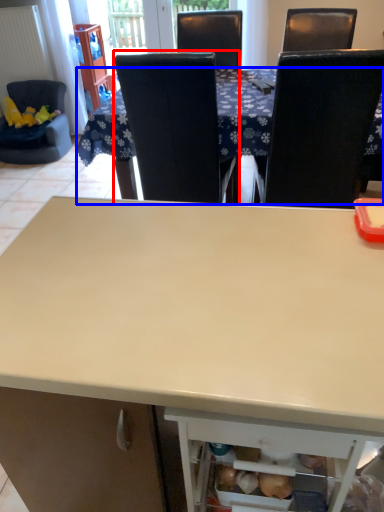
Question: Which object appears farthest to the camera in this image, chair (highlighted by a red box) or table (highlighted by a blue box)?

Choices:
 (A) chair
 (B) table

Answer: (B)